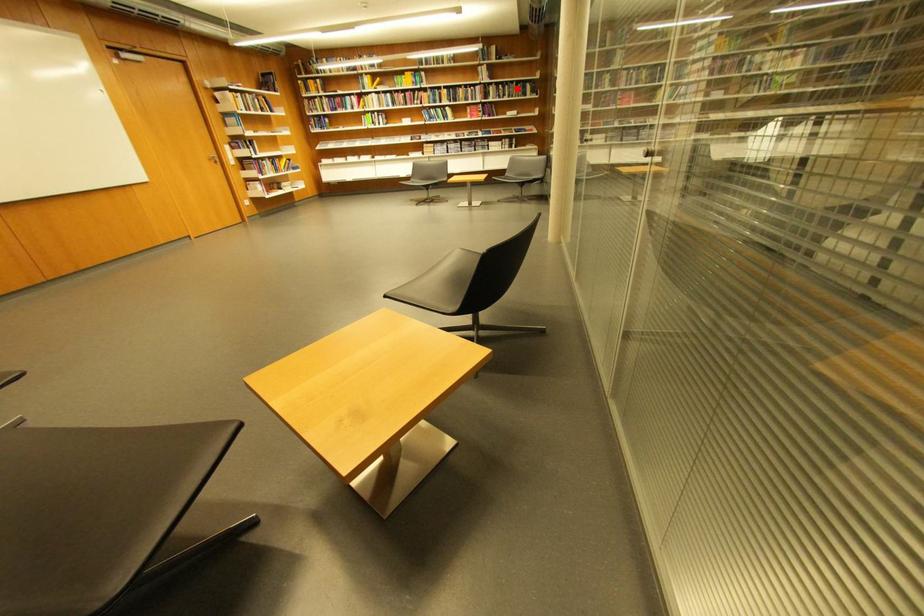
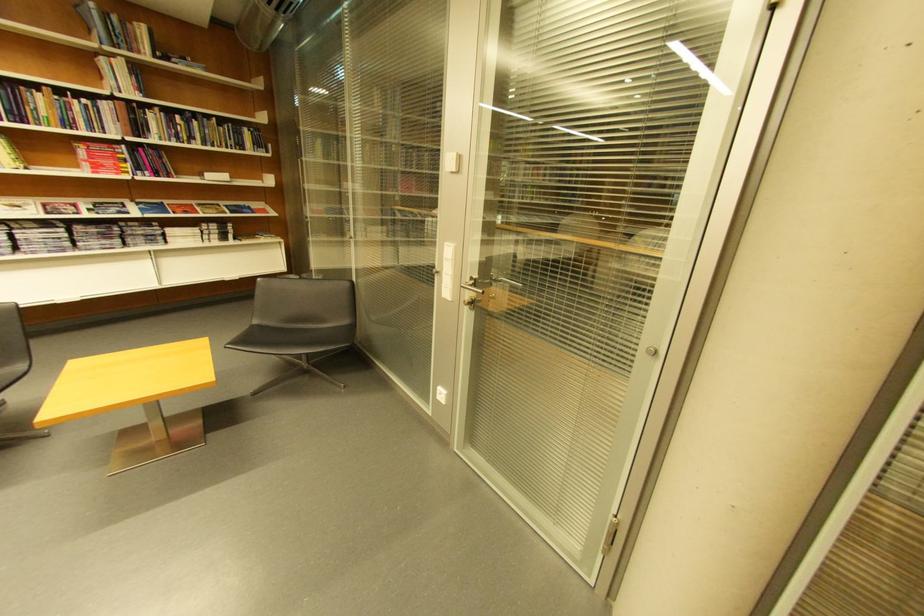
Question: I am providing you with two images of the same scene from different viewpoints. A red point is shown in image1. For the corresponding object point in image2, is it positioned nearer or farther from the camera?

Choices:
 (A) Nearer
 (B) Farther

Answer: (B)